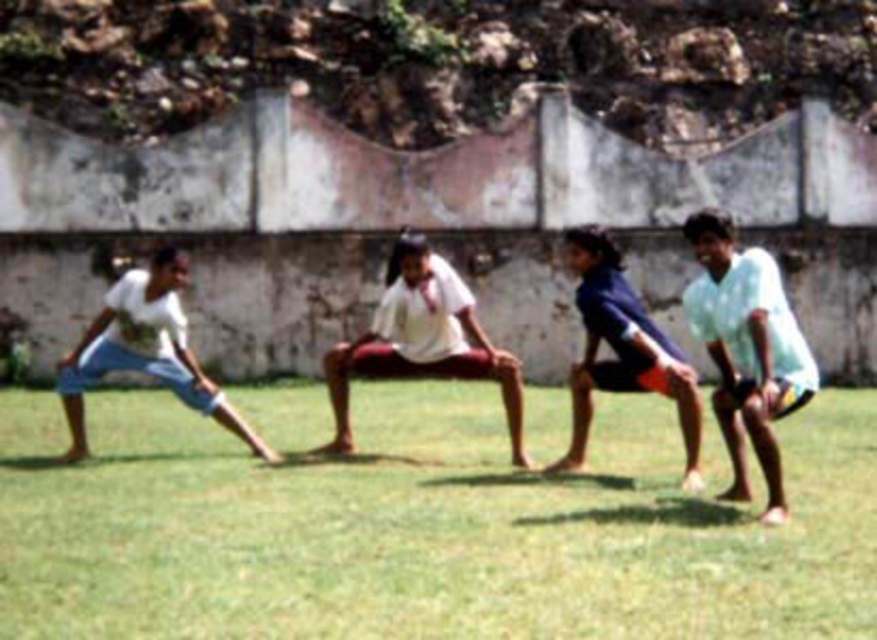
Does white matte shorts at right have a smaller size compared to white cotton shorts at left?

Correct, white matte shorts at right occupies less space than white cotton shorts at left.

Between point (708, 250) and point (232, 419), which one is positioned in front?

Positioned in front is point (708, 250).

Between point (746, 426) and point (225, 408), which one is positioned behind?

The point (225, 408) is behind.

Find the location of a particular element. white matte shorts at right is located at coordinates (746, 349).

Is white cotton shirt at center above dark blue fabric shorts at center?

Incorrect, white cotton shirt at center is not positioned above dark blue fabric shorts at center.

The height and width of the screenshot is (640, 877). I want to click on white cotton shirt at center, so click(x=421, y=340).

Does green grass at center appear under white cotton shorts at left?

Correct, green grass at center is located below white cotton shorts at left.

Is green grass at center in front of white cotton shorts at left?

That is True.

Who is more distant from viewer, (x=118, y=468) or (x=148, y=333)?

The point (x=148, y=333) is behind.

You are a GUI agent. You are given a task and a screenshot of the screen. Output one action in this format:
    pyautogui.click(x=<x>, y=<y>)
    Task: Click on the green grass at center
    This screenshot has height=640, width=877.
    Given the screenshot: What is the action you would take?
    pyautogui.click(x=424, y=529)